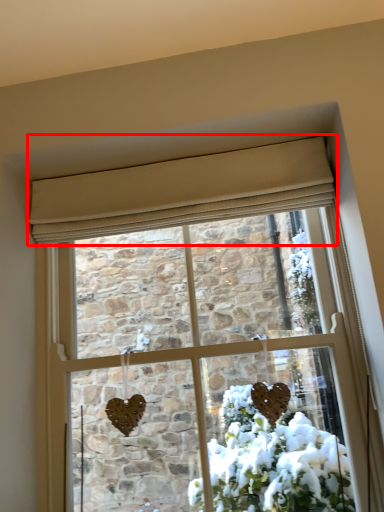
Question: From the image, what is the correct spatial relationship of curtain (annotated by the red box) in relation to window?

Choices:
 (A) left
 (B) right

Answer: (A)